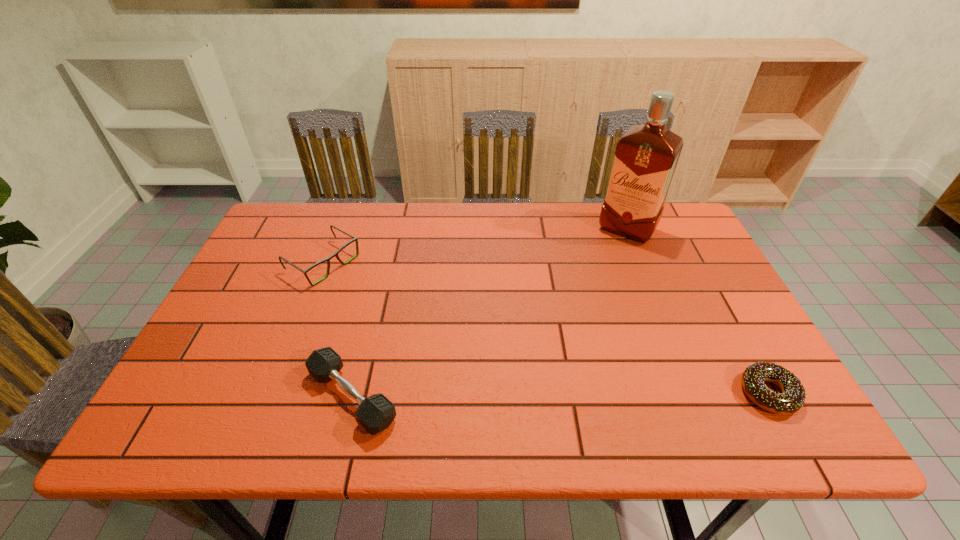
This screenshot has height=540, width=960. I want to click on dumbbell, so click(x=375, y=413).

Where is `the rightmost object`? This screenshot has width=960, height=540. the rightmost object is located at coordinates (793, 396).

I want to click on the shortest object, so click(793, 396).

Locate an element on the screen. This screenshot has width=960, height=540. the tallest object is located at coordinates (646, 156).

Where is `liquor`? This screenshot has width=960, height=540. liquor is located at coordinates (646, 156).

What are the coordinates of `spectacles` in the screenshot? It's located at (x=355, y=239).

The width and height of the screenshot is (960, 540). I want to click on free location located 0.360m on the back of the dumbbell, so click(385, 258).

Image resolution: width=960 pixels, height=540 pixels. In order to click on vacant space located on the back of the doughnut in this screenshot , I will do `click(729, 320)`.

Locate an element on the screen. Image resolution: width=960 pixels, height=540 pixels. vacant space situated 0.390m on the front label of the tallest object is located at coordinates (561, 328).

Locate an element on the screen. The height and width of the screenshot is (540, 960). vacant point located on the front label of the tallest object is located at coordinates (611, 253).